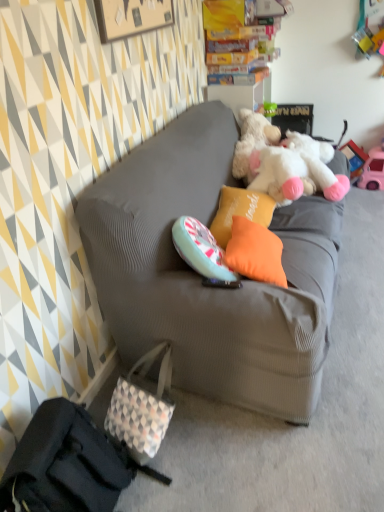
Question: Is pink plastic toy car at right bigger than gray fabric couch at center?

Choices:
 (A) yes
 (B) no

Answer: (B)

Question: Does pink plastic toy car at right have a lesser height compared to gray fabric couch at center?

Choices:
 (A) yes
 (B) no

Answer: (A)

Question: From the image's perspective, is pink plastic toy car at right located beneath gray fabric couch at center?

Choices:
 (A) no
 (B) yes

Answer: (A)

Question: Is pink plastic toy car at right oriented towards gray fabric couch at center?

Choices:
 (A) no
 (B) yes

Answer: (B)

Question: Is pink plastic toy car at right in contact with gray fabric couch at center?

Choices:
 (A) no
 (B) yes

Answer: (A)

Question: Would you say white fluffy teddy bear at upper right is to the left or to the right of gray fabric couch at center in the picture?

Choices:
 (A) right
 (B) left

Answer: (A)

Question: Would you say white fluffy teddy bear at upper right is inside or outside gray fabric couch at center?

Choices:
 (A) inside
 (B) outside

Answer: (A)

Question: Looking at the image, does white fluffy teddy bear at upper right seem bigger or smaller compared to gray fabric couch at center?

Choices:
 (A) small
 (B) big

Answer: (A)

Question: From a real-world perspective, is white fluffy teddy bear at upper right above or below gray fabric couch at center?

Choices:
 (A) below
 (B) above

Answer: (B)

Question: Is pink plastic toy car at right taller or shorter than orange fabric pillow at center, the 1th pillow viewed from the back?

Choices:
 (A) tall
 (B) short

Answer: (A)

Question: From the image's perspective, relative to orange fabric pillow at center, placed as the second pillow when sorted from front to back, is pink plastic toy car at right above or below?

Choices:
 (A) below
 (B) above

Answer: (B)

Question: Choose the correct answer: Is pink plastic toy car at right inside orange fabric pillow at center, placed as the second pillow when sorted from front to back, or outside it?

Choices:
 (A) inside
 (B) outside

Answer: (B)

Question: In the image, is pink plastic toy car at right positioned in front of or behind orange fabric pillow at center, placed as the second pillow when sorted from front to back?

Choices:
 (A) front
 (B) behind

Answer: (B)

Question: From the image's perspective, is white checkered fabric handbag at lower left, the second handbag positioned from the back, positioned above or below white fluffy teddy bear at upper right?

Choices:
 (A) below
 (B) above

Answer: (A)

Question: Is white checkered fabric handbag at lower left, which appears as the first handbag when viewed from the front, inside or outside of white fluffy teddy bear at upper right?

Choices:
 (A) inside
 (B) outside

Answer: (B)